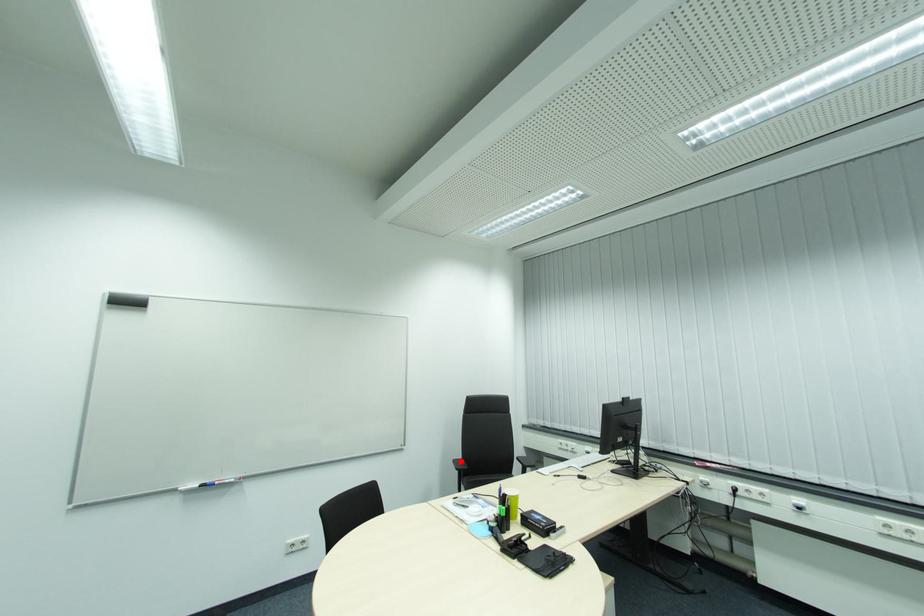
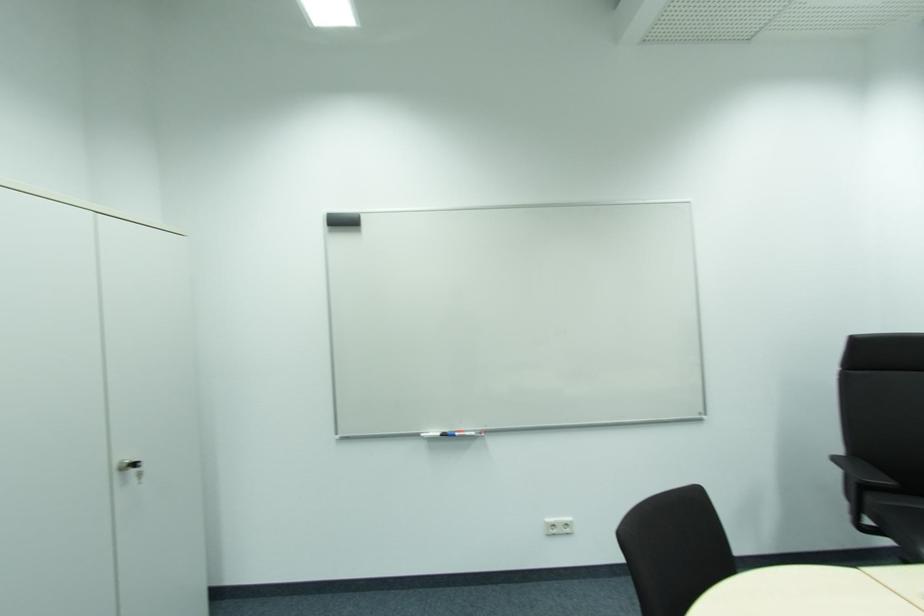
Locate, in the second image, the point that corresponds to the highlighted location in the first image.

(842, 459)